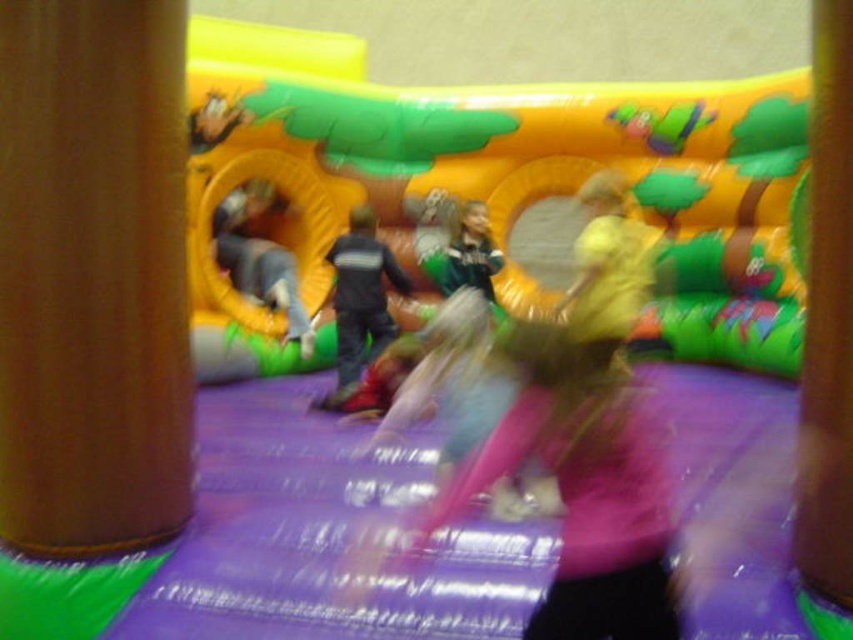
Measure the distance from purple fabric slide at center to brown leather pillar at left.

purple fabric slide at center is 4.82 meters away from brown leather pillar at left.

Is purple fabric slide at center shorter than brown leather pillar at left?

Indeed, purple fabric slide at center has a lesser height compared to brown leather pillar at left.

The image size is (853, 640). What are the coordinates of `purple fabric slide at center` in the screenshot? It's located at (492, 186).

Can you confirm if purple fabric slide at center is bigger than brown wood pillar at center left?

Actually, purple fabric slide at center might be smaller than brown wood pillar at center left.

This screenshot has width=853, height=640. What do you see at coordinates (492, 186) in the screenshot?
I see `purple fabric slide at center` at bounding box center [492, 186].

Does point (271, 26) come farther from viewer compared to point (837, 148)?

Yes, it is.

The image size is (853, 640). In order to click on purple fabric slide at center in this screenshot , I will do `click(492, 186)`.

Based on the photo, between brown leather pillar at left and brown wood pillar at center left, which one has more height?

Standing taller between the two is brown wood pillar at center left.

Can you confirm if brown leather pillar at left is wider than brown wood pillar at center left?

Yes, brown leather pillar at left is wider than brown wood pillar at center left.

Identify the location of brown leather pillar at left. The image size is (853, 640). (91, 276).

This screenshot has height=640, width=853. Identify the location of brown leather pillar at left. (x=91, y=276).